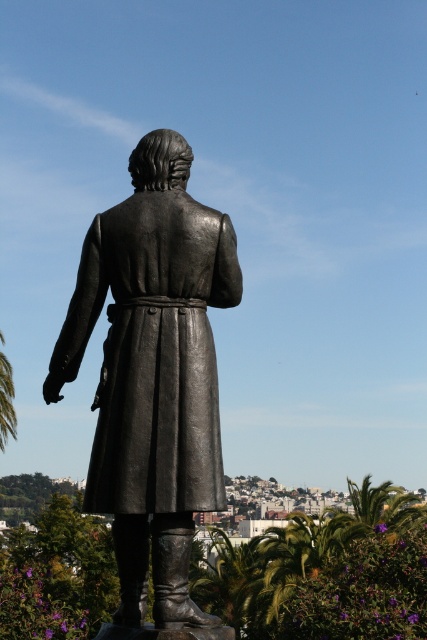
Who is more distant from viewer, (152, 465) or (11, 406)?

The point (11, 406) is more distant.

Is polished bronze statue at center closer to the viewer compared to green leafy palm tree at lower left?

Yes.

Where is `polished bronze statue at center`? polished bronze statue at center is located at coordinates (154, 372).